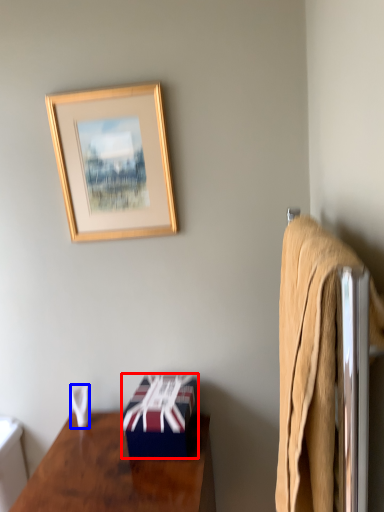
Question: Among these objects, which one is nearest to the camera, box (highlighted by a red box) or towel/napkin (highlighted by a blue box)?

Choices:
 (A) box
 (B) towel/napkin

Answer: (A)